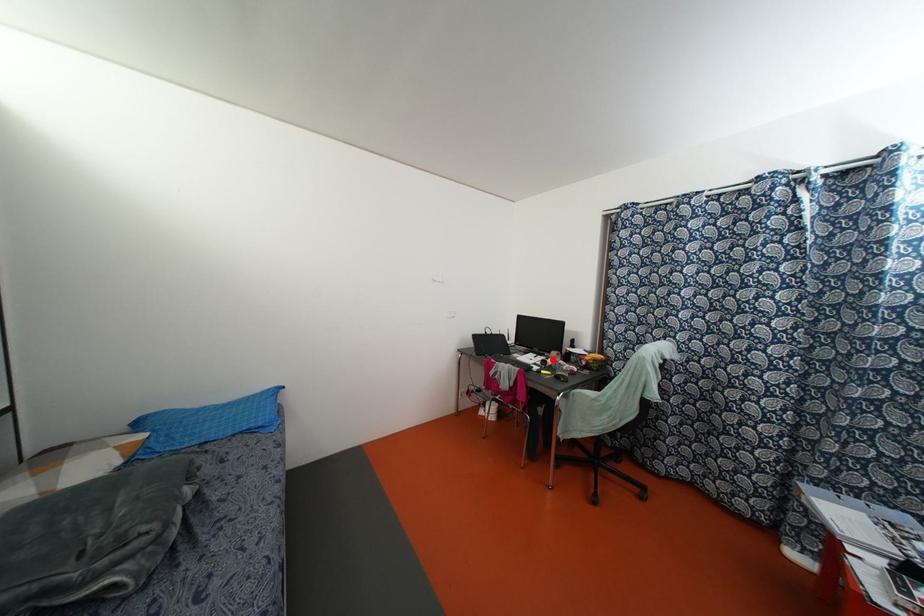
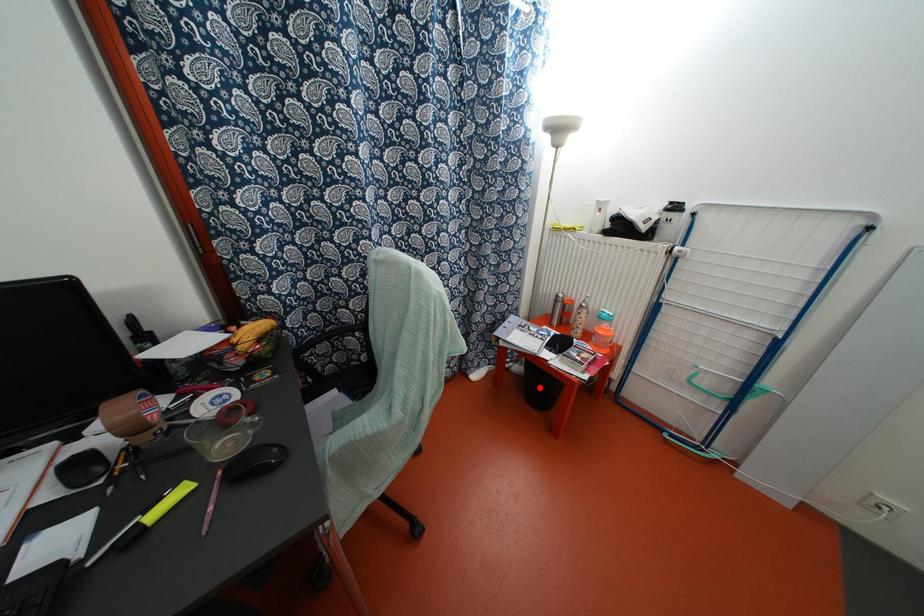
I am providing you with two images of the same scene from different viewpoints. A red point is marked on the first image and another point is marked on the second image. Do the highlighted points in image1 and image2 indicate the same real-world spot?

No